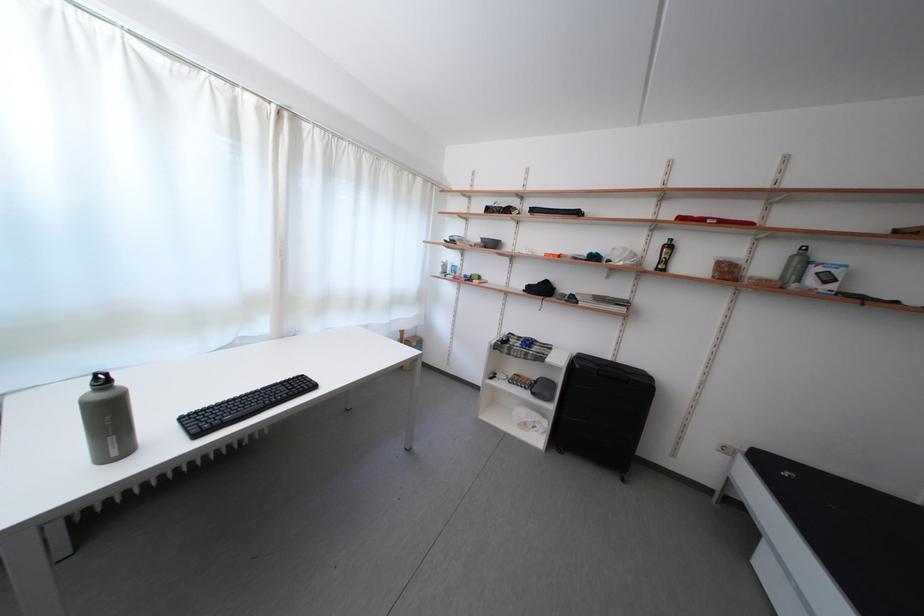
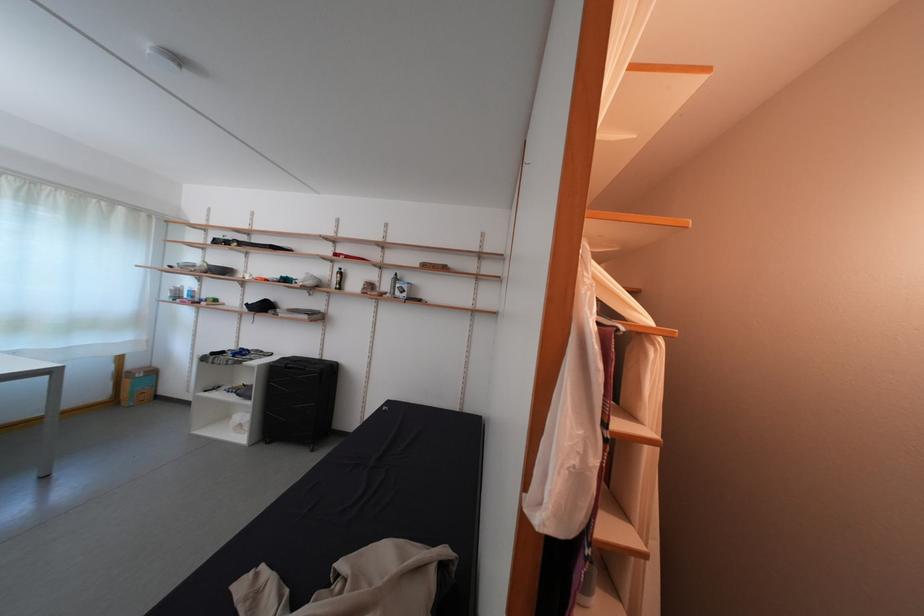
The point at (416, 341) is marked in the first image. Where is the corresponding point in the second image?

(140, 371)